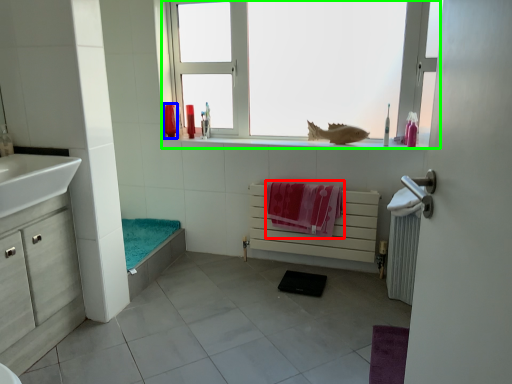
Question: Considering the real-world distances, which object is farthest from beach towel (highlighted by a red box)? toiletry (highlighted by a blue box) or window (highlighted by a green box)?

Choices:
 (A) toiletry
 (B) window

Answer: (A)